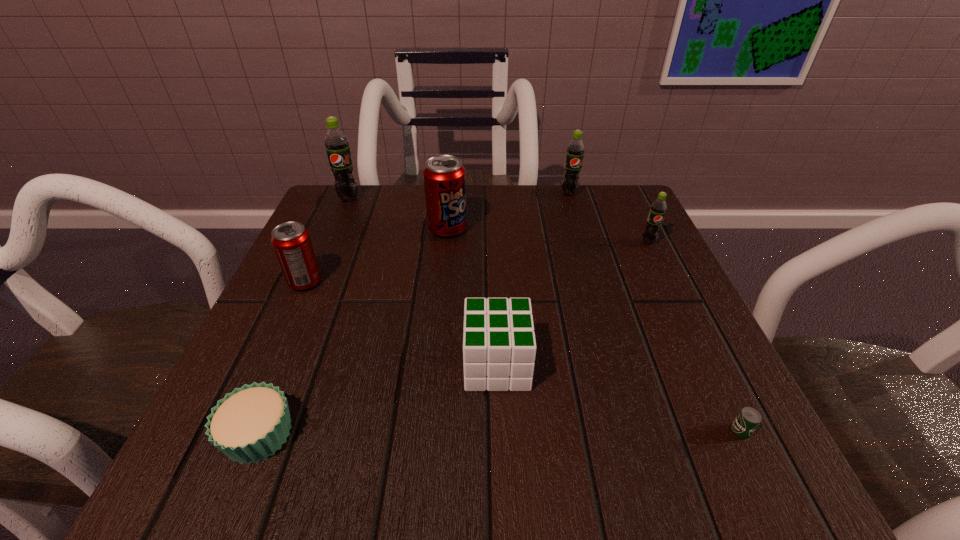
Where is `green soda that is the third closest to the beer can`? green soda that is the third closest to the beer can is located at coordinates (336, 143).

Locate which green soda is the third closest to the sixth farthest object. Please provide its 2D coordinates. Your answer should be formatted as a tuple, i.e. [(x, y)], where the tuple contains the x and y coordinates of a point satisfying the conditions above.

[(336, 143)]

This screenshot has width=960, height=540. I want to click on vacant space that satisfies the following two spatial constraints: 1. on the front label of the leftmost green soda; 2. on the left side of the second shortest object, so click(248, 434).

Locate an element on the screen. This screenshot has height=540, width=960. free region that satisfies the following two spatial constraints: 1. on the front label of the sixth object from left to right; 2. on the red face of the cube is located at coordinates (620, 365).